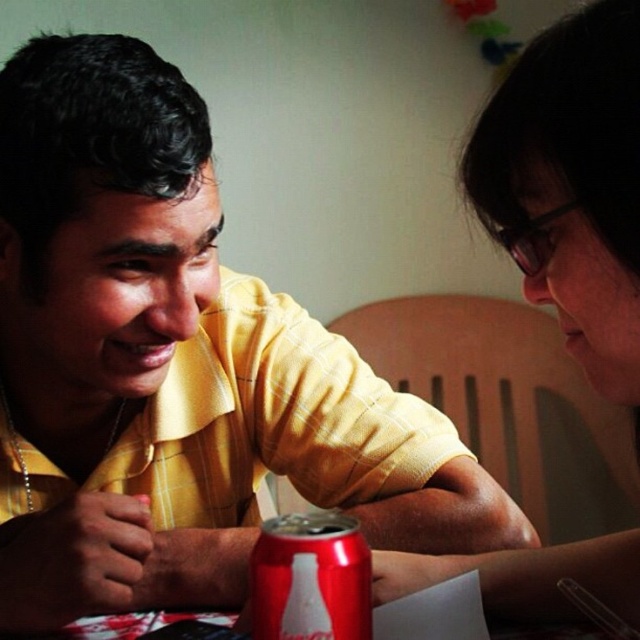
Question: Which point is closer to the camera?

Choices:
 (A) matte black glasses at upper right
 (B) red matte can at center

Answer: (A)

Question: Can you confirm if matte black glasses at upper right is wider than red matte can at center?

Choices:
 (A) yes
 (B) no

Answer: (A)

Question: Is matte black glasses at upper right behind red matte can at center?

Choices:
 (A) yes
 (B) no

Answer: (B)

Question: Which point is closer to the camera taking this photo?

Choices:
 (A) (634, 339)
 (B) (285, 552)

Answer: (A)

Question: Is matte black glasses at upper right wider than red matte can at center?

Choices:
 (A) no
 (B) yes

Answer: (B)